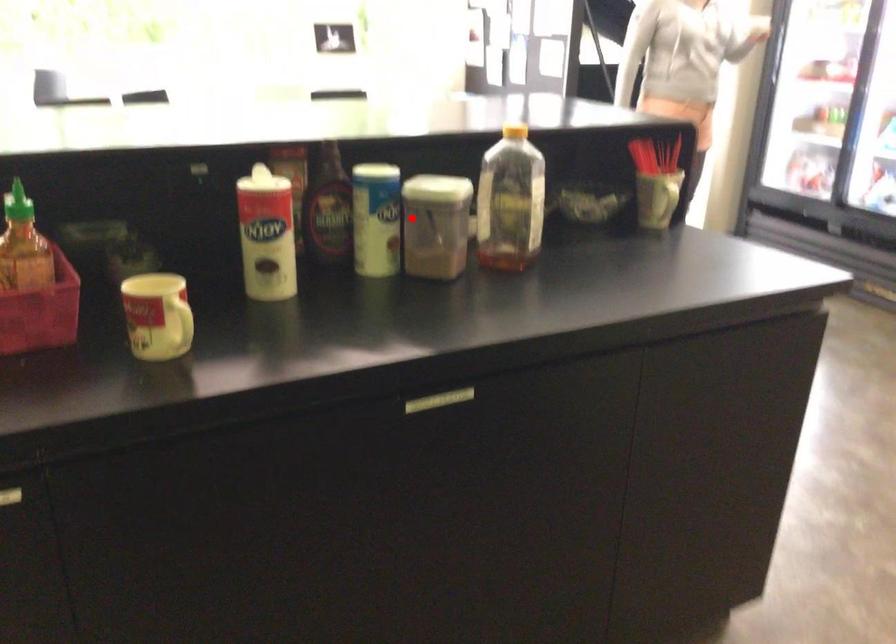
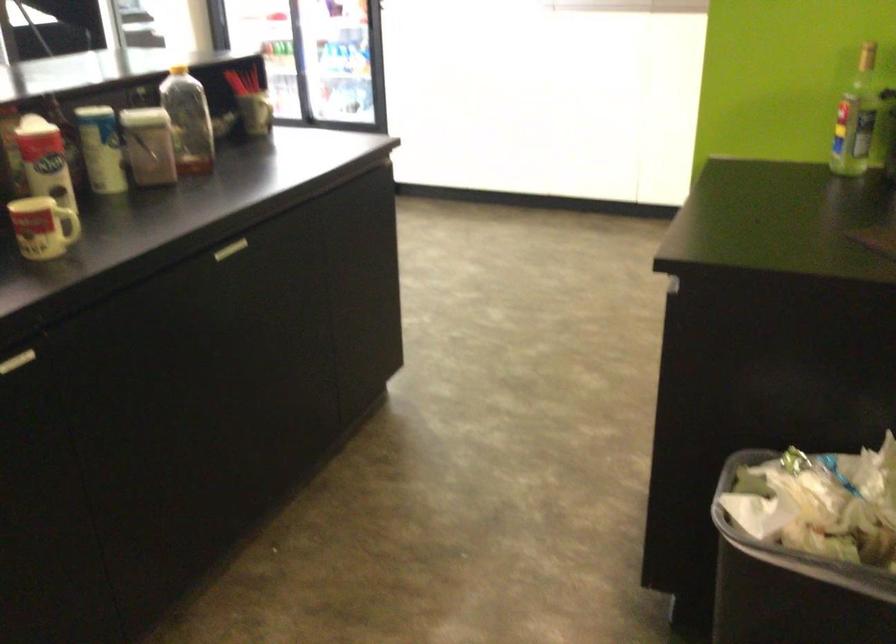
Find the pixel in the second image that matches the highlighted location in the first image.

(149, 146)